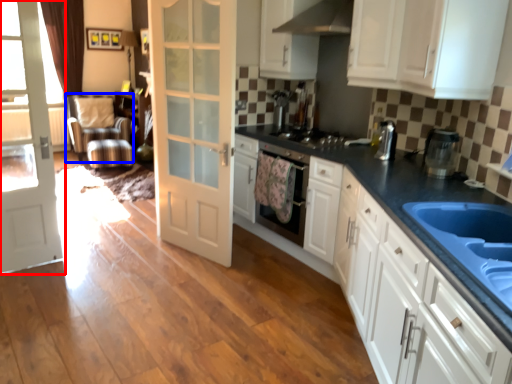
Question: Which of the following is the farthest to the observer, door (highlighted by a red box) or sit (highlighted by a blue box)?

Choices:
 (A) door
 (B) sit

Answer: (B)